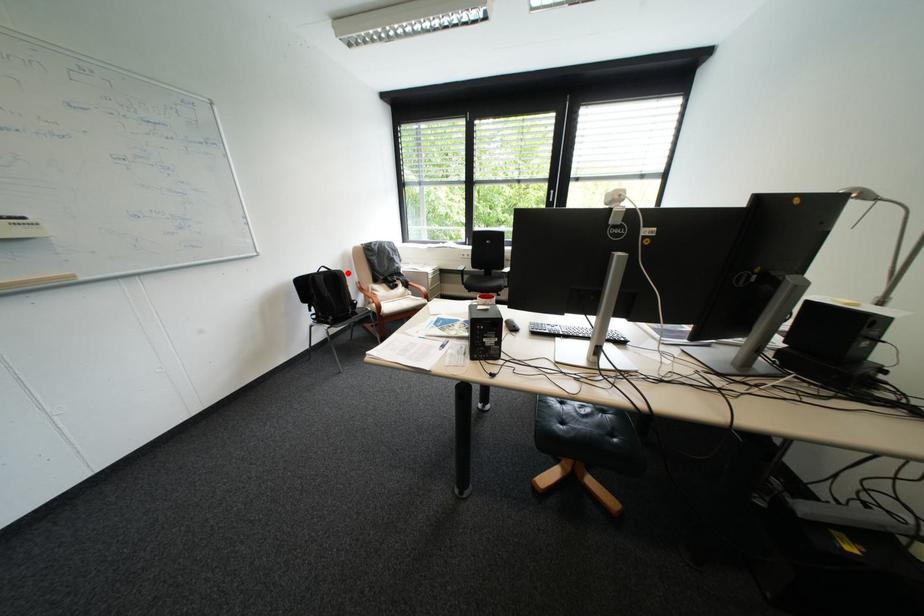
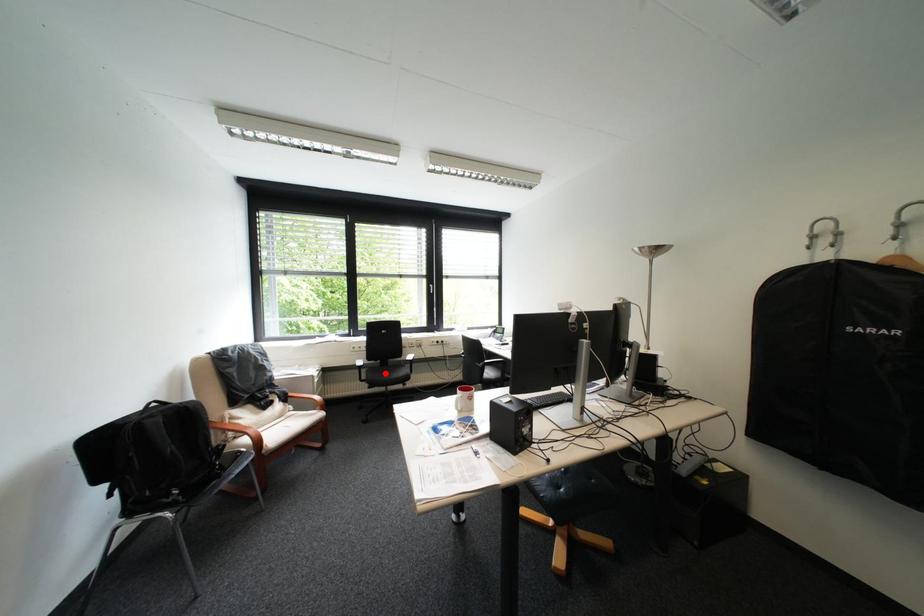
I am providing you with two images of the same scene from different viewpoints. A red point is marked on the first image and another point is marked on the second image. Is the red point in image1 aligned with the point shown in image2?

No